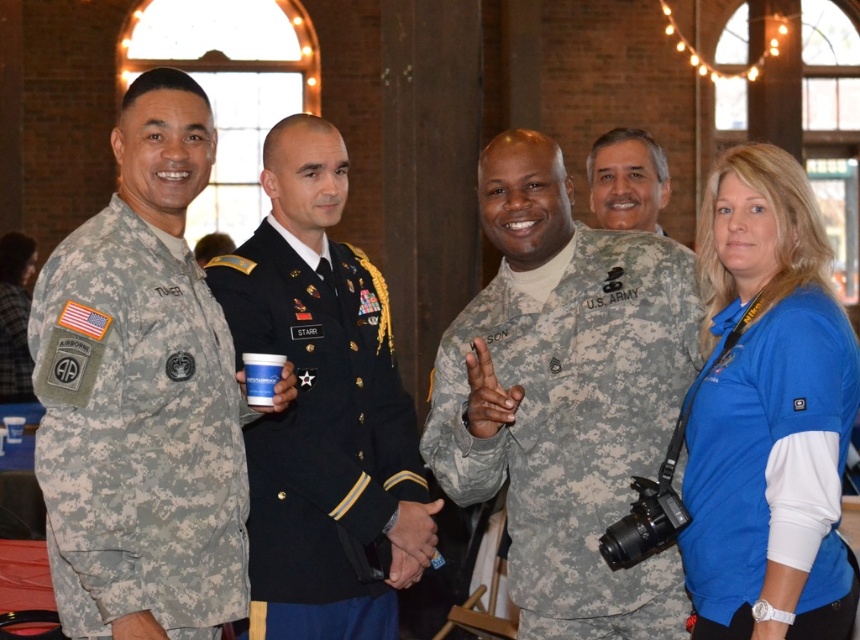
Does camouflage fabric us army uniform at center have a greater width compared to blue polyester shirt at upper right?

Correct, the width of camouflage fabric us army uniform at center exceeds that of blue polyester shirt at upper right.

Who is more distant from viewer, [604,372] or [705,545]?

The point [604,372] is more distant.

You are a GUI agent. You are given a task and a screenshot of the screen. Output one action in this format:
    pyautogui.click(x=<x>, y=<y>)
    Task: Click on the camouflage fabric us army uniform at center
    
    Given the screenshot: What is the action you would take?
    click(x=574, y=422)

Can you confirm if blue polyester shirt at upper right is positioned to the left of black silk uniform at center?

In fact, blue polyester shirt at upper right is to the right of black silk uniform at center.

Does blue polyester shirt at upper right appear under black silk uniform at center?

Incorrect, blue polyester shirt at upper right is not positioned below black silk uniform at center.

Which is in front, point (771, 460) or point (385, 292)?

Positioned in front is point (771, 460).

Locate an element on the screen. The height and width of the screenshot is (640, 860). blue polyester shirt at upper right is located at coordinates (766, 412).

Does camouflage fabric us army uniform at center have a smaller size compared to camouflage uniform at center?

Correct, camouflage fabric us army uniform at center occupies less space than camouflage uniform at center.

Is point (531, 592) positioned behind point (597, 184)?

No.

Between point (578, 637) and point (624, 221), which one is positioned in front?

Positioned in front is point (578, 637).

At what (x,y) coordinates should I click in order to perform the action: click on camouflage fabric us army uniform at center. Please return your answer as a coordinate pair (x, y). This screenshot has width=860, height=640. Looking at the image, I should click on [574, 422].